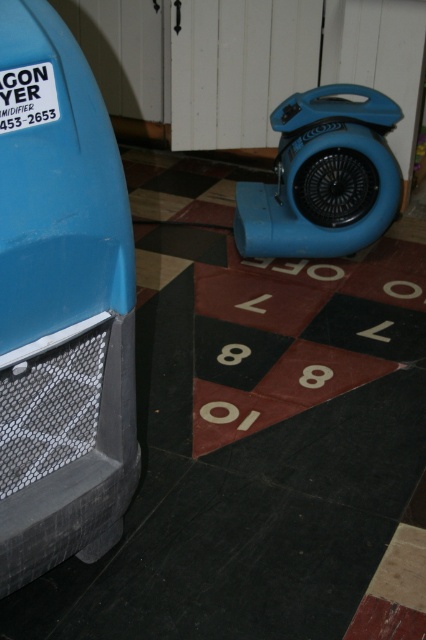
You are a delivery person who needs to place a new blue plastic fan at center right on the floor without blocking the numbers on the checkered tiles. The existing matte blue car at left is already occupying some space. Considering their heights, will the fan cast a shadow over the numbers when placed?

The matte blue car at left is taller than the blue plastic fan at center right. Since the car is taller, it will cast a larger shadow, but the fan being shorter might not block the numbers. However, the question is about the fan casting a shadow. Since the fan is shorter, its shadow would be smaller and less likely to cover the numbers unless placed directly over them. But the key detail is their height comparison from the description. Since the car is taller, the fan is shorter, so its shadow is smaller.

You are standing in front of the checkered floor with numbered tiles. There is a matte blue car at left. If you want to reach the car without stepping on any tiles with the number 7, which numbered tiles should you avoid stepping on?

You should avoid stepping on the tiles with the number 7 because the matte blue car at left is 38.49 inches away from the camera, and stepping on those tiles might be in the path towards the car.

You are a delivery person who needs to place a new package between the matte blue car at left and the blue plastic fan at center right. The package requires a space of 5 feet. Is there enough space between them?

The distance between the matte blue car at left and the blue plastic fan at center right is 4.89 feet, which is slightly less than the required 5 feet. Therefore, there isn not enough space to place the package between them.